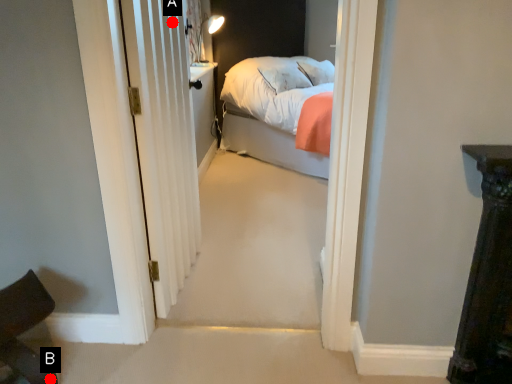
Question: Two points are circled on the image, labeled by A and B beside each circle. Which point is farther from the camera taking this photo?

Choices:
 (A) A is further
 (B) B is further

Answer: (A)